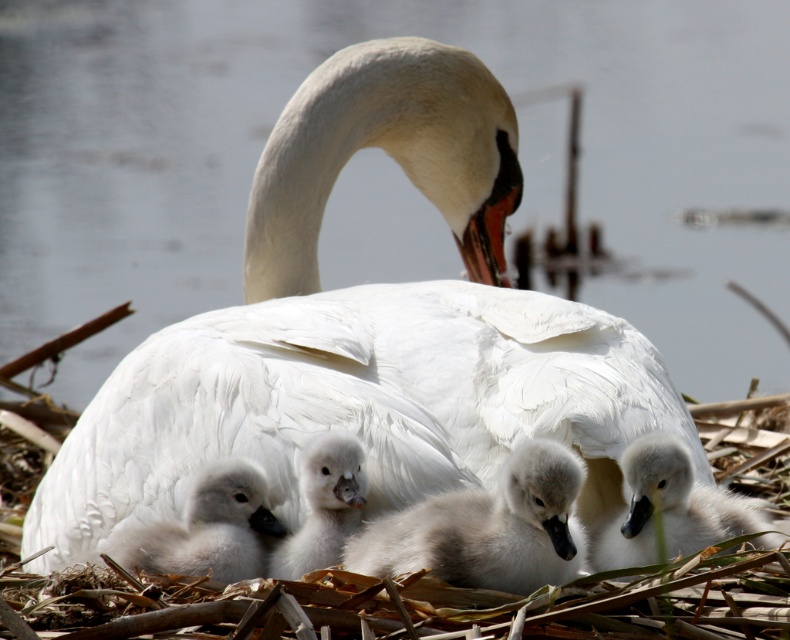
Question: Is soft gray down at center bigger than fluffy white cygnet at lower left?

Choices:
 (A) no
 (B) yes

Answer: (B)

Question: Does soft gray downy cygnet at center have a smaller size compared to soft gray down at center?

Choices:
 (A) no
 (B) yes

Answer: (A)

Question: Which point is farther from the camera taking this photo?

Choices:
 (A) (239, 525)
 (B) (386, 570)
 (C) (641, 481)
 (D) (307, 512)

Answer: (D)

Question: Which point is farther from the camera taking this photo?

Choices:
 (A) [237, 563]
 (B) [623, 516]
 (C) [407, 561]

Answer: (B)

Question: Among these points, which one is nearest to the camera?

Choices:
 (A) [330, 484]
 (B) [448, 518]
 (C) [205, 524]
 (D) [772, 541]

Answer: (B)

Question: Does soft gray downy cygnet at center have a larger size compared to white fluffy swan at center?

Choices:
 (A) no
 (B) yes

Answer: (B)